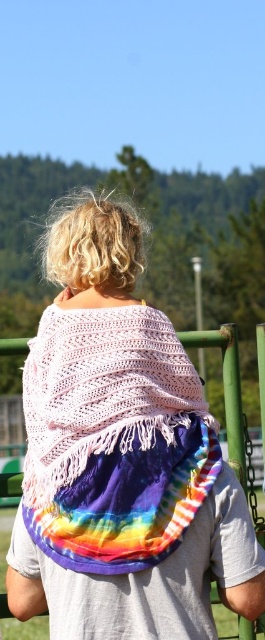
Does tie-dye fabric at center appear on the right side of crochet lace shawl at center?

In fact, tie-dye fabric at center is to the left of crochet lace shawl at center.

Is tie-dye fabric at center above crochet lace shawl at center?

Yes.

Image resolution: width=265 pixels, height=640 pixels. Describe the element at coordinates (121, 456) in the screenshot. I see `tie-dye fabric at center` at that location.

Where is `tie-dye fabric at center`? The image size is (265, 640). tie-dye fabric at center is located at coordinates (121, 456).